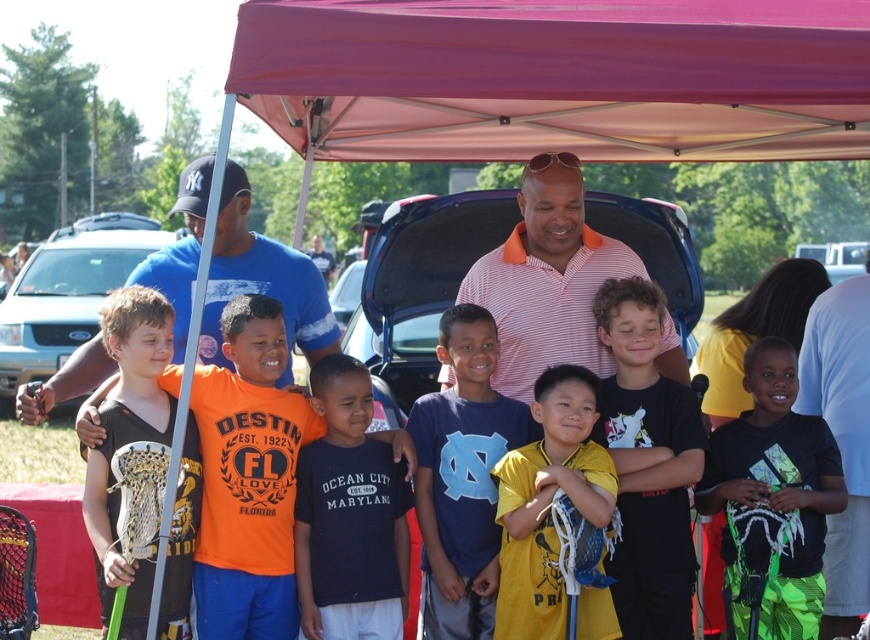
You are standing at the position of point [9,307] and want to walk towards the position of point [567,403]. Based on the scene description, will you be moving towards the group of people under the red canopy tent?

Yes, because point [567,403] is in front of point [9,307], meaning you are moving towards the direction where the group under the red canopy tent is located.

You are a photographer standing at the edge of the group. You want to take a photo that includes both the yellow matte shirt at center and the matte black lacrosse stick at left. Will the lacrosse stick be visible in the photo if you focus on the shirt?

The matte black lacrosse stick at left is behind the yellow matte shirt at center, so if you focus on the shirt, the lacrosse stick might be partially or fully obscured and may not be clearly visible in the photo.